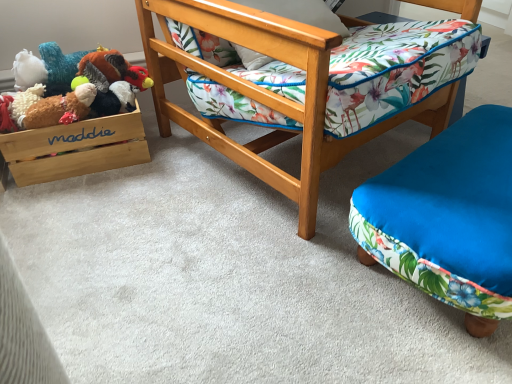
What do you see at coordinates (267, 92) in the screenshot?
I see `wooden chair at center` at bounding box center [267, 92].

Describe the element at coordinates (75, 148) in the screenshot. The height and width of the screenshot is (384, 512). I see `wooden/matte storage box at left` at that location.

Image resolution: width=512 pixels, height=384 pixels. Identify the location of fluffy plush turkey at upper left, marked as the second toy in a bottom-to-top arrangement. (112, 70).

Between wooden/matte storage box at left and fluffy plush turkey at upper left, marked as the second toy in a bottom-to-top arrangement, which one has more height?

With more height is wooden/matte storage box at left.

Which of these two, wooden/matte storage box at left or fluffy plush turkey at upper left, marked as the second toy in a bottom-to-top arrangement, is bigger?

With larger size is wooden/matte storage box at left.

Considering the relative sizes of wooden/matte storage box at left and fluffy plush turkey at upper left, marked as the second toy in a bottom-to-top arrangement, in the image provided, is wooden/matte storage box at left wider than fluffy plush turkey at upper left, marked as the second toy in a bottom-to-top arrangement,?

Correct, the width of wooden/matte storage box at left exceeds that of fluffy plush turkey at upper left, marked as the second toy in a bottom-to-top arrangement.

Looking at this image, measure the distance between wooden/matte storage box at left and fluffy plush turkey at upper left, marked as the second toy in a bottom-to-top arrangement.

wooden/matte storage box at left is 20.23 centimeters from fluffy plush turkey at upper left, marked as the second toy in a bottom-to-top arrangement.

Which object is thinner, wooden chair at center or blue fabric ottoman at lower right?

blue fabric ottoman at lower right.

Is wooden chair at center bigger or smaller than blue fabric ottoman at lower right?

Considering their sizes, wooden chair at center takes up more space than blue fabric ottoman at lower right.

Would you say blue fabric ottoman at lower right is part of wooden chair at center's contents?

No, blue fabric ottoman at lower right is not surrounded by wooden chair at center.

Is wooden/matte storage box at left in contact with fluffy brown plush at left, which is the second toy in top-to-bottom order?

Yes, wooden/matte storage box at left is right next to fluffy brown plush at left, which is the second toy in top-to-bottom order, and making contact.

From a real-world perspective, is wooden/matte storage box at left under fluffy brown plush at left, acting as the 1th toy starting from the bottom?

Yes, from a real-world perspective, wooden/matte storage box at left is beneath fluffy brown plush at left, acting as the 1th toy starting from the bottom.

Relative to fluffy brown plush at left, which is the second toy in top-to-bottom order, is wooden/matte storage box at left in front or behind?

wooden/matte storage box at left is positioned farther from the viewer than fluffy brown plush at left, which is the second toy in top-to-bottom order.

Find the location of a particular element. the 1st toy to the right of the wooden/matte storage box at left, counting from the anchor's position is located at coordinates (60, 108).

From the image's perspective, does fluffy plush turkey at upper left, marked as the second toy in a bottom-to-top arrangement, appear lower than wooden chair at center?

No.

Can you confirm if fluffy plush turkey at upper left, marked as the second toy in a bottom-to-top arrangement, is taller than wooden chair at center?

In fact, fluffy plush turkey at upper left, marked as the second toy in a bottom-to-top arrangement, may be shorter than wooden chair at center.

Considering the sizes of objects fluffy plush turkey at upper left, marked as the second toy in a bottom-to-top arrangement, and wooden chair at center in the image provided, who is bigger, fluffy plush turkey at upper left, marked as the second toy in a bottom-to-top arrangement, or wooden chair at center?

wooden chair at center.

Can you confirm if wooden chair at center is shorter than fluffy plush turkey at upper left, marked as the second toy in a bottom-to-top arrangement?

In fact, wooden chair at center may be taller than fluffy plush turkey at upper left, marked as the second toy in a bottom-to-top arrangement.

From a real-world perspective, is wooden chair at center positioned over fluffy plush turkey at upper left, marked as the second toy in a bottom-to-top arrangement, based on gravity?

Indeed, from a real-world perspective, wooden chair at center stands above fluffy plush turkey at upper left, marked as the second toy in a bottom-to-top arrangement.

Which object is wider, wooden chair at center or fluffy plush turkey at upper left, the first toy viewed from the top?

With larger width is wooden chair at center.

Which is in front, point (271, 107) or point (103, 81)?

The point (271, 107) is closer.

Based on the photo, who is smaller, wooden/matte storage box at left or blue fabric ottoman at lower right?

wooden/matte storage box at left.

From the image's perspective, is wooden/matte storage box at left below blue fabric ottoman at lower right?

Incorrect, from the image's perspective, wooden/matte storage box at left is higher than blue fabric ottoman at lower right.

Can you tell me how much wooden/matte storage box at left and blue fabric ottoman at lower right differ in facing direction?

There is a 19.2-degree angle between the facing directions of wooden/matte storage box at left and blue fabric ottoman at lower right.

Could you tell me if wooden/matte storage box at left is turned towards blue fabric ottoman at lower right?

No, wooden/matte storage box at left does not turn towards blue fabric ottoman at lower right.

Is wooden chair at center positioned with its back to fluffy brown plush at left, which is the second toy in top-to-bottom order?

No, fluffy brown plush at left, which is the second toy in top-to-bottom order, is not at the back of wooden chair at center.

Between wooden chair at center and fluffy brown plush at left, acting as the 1th toy starting from the bottom, which one has larger size?

wooden chair at center is bigger.

Which is more to the right, wooden chair at center or fluffy brown plush at left, which is the second toy in top-to-bottom order?

wooden chair at center is more to the right.

Is wooden chair at center in contact with fluffy brown plush at left, which is the second toy in top-to-bottom order?

wooden chair at center is not next to fluffy brown plush at left, which is the second toy in top-to-bottom order, and they're not touching.

At what (x,y) coordinates should I click in order to perform the action: click on toy that is behind the wooden/matte storage box at left. Please return your answer as a coordinate pair (x, y). This screenshot has width=512, height=384. Looking at the image, I should click on (112, 70).

The image size is (512, 384). Identify the location of furniture below the wooden chair at center (from a real-world perspective). (447, 218).

Considering their positions, is fluffy plush turkey at upper left, the first toy viewed from the top, positioned further to blue fabric ottoman at lower right than wooden/matte storage box at left?

Among the two, fluffy plush turkey at upper left, the first toy viewed from the top, is located further to blue fabric ottoman at lower right.

From the image, which object appears to be farther from fluffy plush turkey at upper left, the first toy viewed from the top, wooden/matte storage box at left or wooden chair at center?

wooden chair at center is further to fluffy plush turkey at upper left, the first toy viewed from the top.

Based on their spatial positions, is wooden chair at center or fluffy plush turkey at upper left, the first toy viewed from the top, further from fluffy brown plush at left, which is the second toy in top-to-bottom order?

Among the two, wooden chair at center is located further to fluffy brown plush at left, which is the second toy in top-to-bottom order.

Which object lies further to the anchor point blue fabric ottoman at lower right, wooden/matte storage box at left or wooden chair at center?

wooden/matte storage box at left is further to blue fabric ottoman at lower right.

Looking at the image, which one is located further to blue fabric ottoman at lower right, wooden/matte storage box at left or fluffy brown plush at left, acting as the 1th toy starting from the bottom?

fluffy brown plush at left, acting as the 1th toy starting from the bottom, is positioned further to the anchor blue fabric ottoman at lower right.

Considering their positions, is blue fabric ottoman at lower right positioned further to fluffy plush turkey at upper left, the first toy viewed from the top, than wooden/matte storage box at left?

The object further to fluffy plush turkey at upper left, the first toy viewed from the top, is blue fabric ottoman at lower right.

Looking at the image, which one is located further to wooden/matte storage box at left, blue fabric ottoman at lower right or wooden chair at center?

blue fabric ottoman at lower right lies further to wooden/matte storage box at left than the other object.

Estimate the real-world distances between objects in this image. Which object is further from fluffy plush turkey at upper left, marked as the second toy in a bottom-to-top arrangement, blue fabric ottoman at lower right or wooden chair at center?

blue fabric ottoman at lower right lies further to fluffy plush turkey at upper left, marked as the second toy in a bottom-to-top arrangement, than the other object.

Identify the location of toy between fluffy plush turkey at upper left, marked as the second toy in a bottom-to-top arrangement, and wooden/matte storage box at left vertically. (60, 108).

Locate an element on the screen. chair between fluffy plush turkey at upper left, marked as the second toy in a bottom-to-top arrangement, and blue fabric ottoman at lower right from left to right is located at coordinates (267, 92).

I want to click on toy located between fluffy brown plush at left, acting as the 1th toy starting from the bottom, and wooden chair at center in the left-right direction, so click(x=112, y=70).

The image size is (512, 384). Identify the location of chair between wooden/matte storage box at left and blue fabric ottoman at lower right in the horizontal direction. coord(267,92).